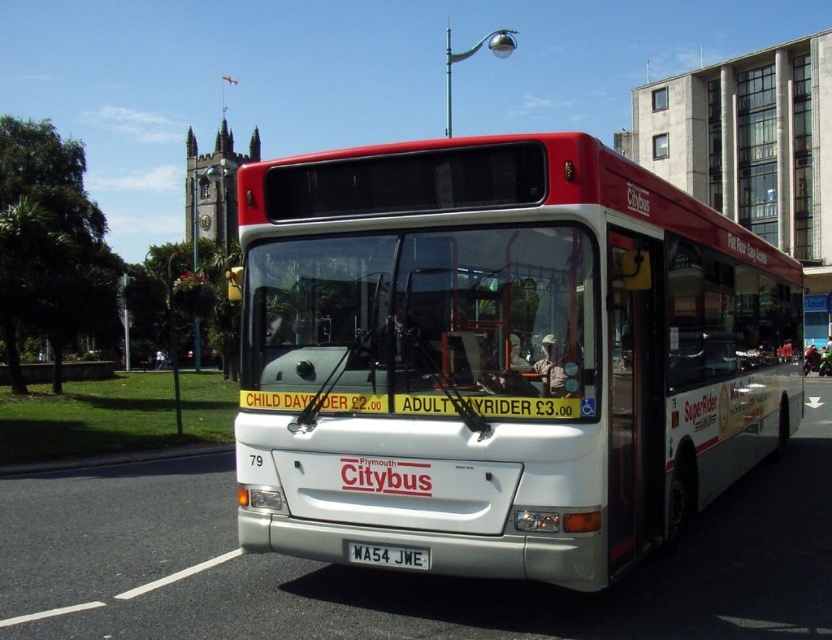
Consider the image. You are a passenger waiting at the bus stop and see the white matte bus at center and the white metallic license plate at center. Which object is closer to the right side of the image?

The white matte bus at center is closer to the right side of the image because it is positioned to the right of the white metallic license plate at center.

You are standing on the sidewalk and see the white matte bus at center and the white metallic license plate at center. Which object is nearer to you?

The white matte bus at center is closer to the viewer than the white metallic license plate at center.